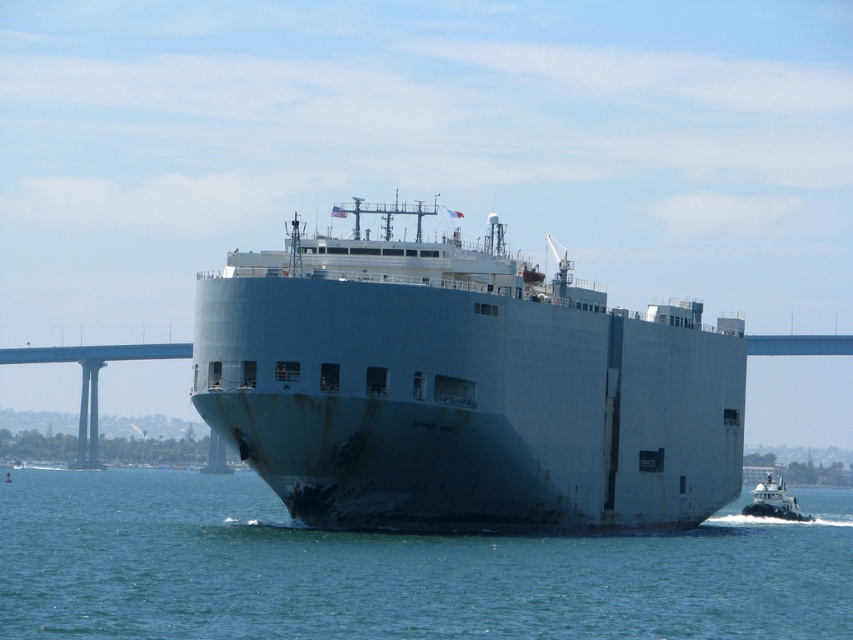
Question: Which object is positioned closest to the blue water at center?

Choices:
 (A) gray matte cargo ship at center
 (B) white glossy tugboat at lower right

Answer: (A)

Question: Which of the following is the farthest from the observer?

Choices:
 (A) white glossy tugboat at lower right
 (B) gray matte cargo ship at center

Answer: (A)

Question: Is blue water at center bigger than white glossy tugboat at lower right?

Choices:
 (A) no
 (B) yes

Answer: (B)

Question: Is gray matte cargo ship at center closer to the viewer compared to blue water at center?

Choices:
 (A) yes
 (B) no

Answer: (B)

Question: Which object is positioned closest to the white glossy tugboat at lower right?

Choices:
 (A) blue water at center
 (B) gray matte cargo ship at center

Answer: (B)

Question: Can you confirm if blue water at center is bigger than white glossy tugboat at lower right?

Choices:
 (A) yes
 (B) no

Answer: (A)